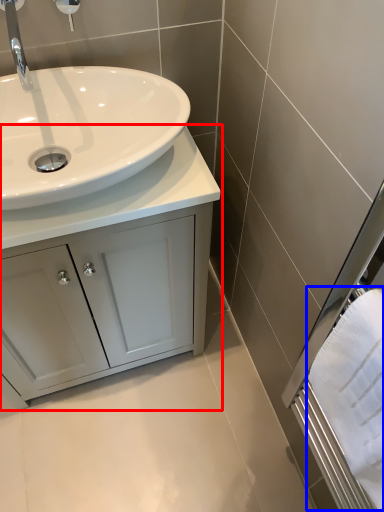
Question: Which point is closer to the camera, bathroom cabinet (highlighted by a red box) or bath towel (highlighted by a blue box)?

Choices:
 (A) bathroom cabinet
 (B) bath towel

Answer: (B)